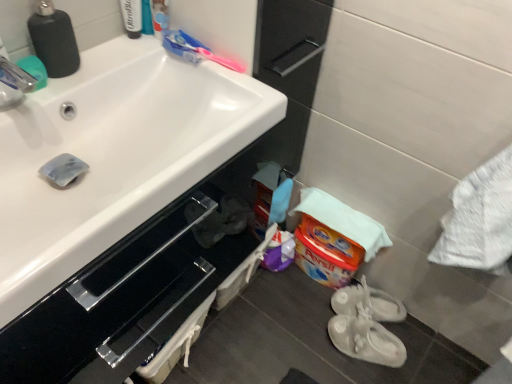
Where is `black glossy drawer at lower center`? This screenshot has width=512, height=384. black glossy drawer at lower center is located at coordinates (155, 317).

Locate an element on the screen. black matte soap dispenser at upper left is located at coordinates coord(54,39).

Where is `white glossy tube at upper left, the first toiletry positioned from the left`? white glossy tube at upper left, the first toiletry positioned from the left is located at coordinates click(132, 17).

Is white rubber shoes at lower right, positioned as the 1th footwear in back-to-front order, not within translucent plastic toothbrush at upper center, positioned as the second toiletry in left-to-right order?

Yes, white rubber shoes at lower right, positioned as the 1th footwear in back-to-front order, is located beyond the bounds of translucent plastic toothbrush at upper center, positioned as the second toiletry in left-to-right order.

How many degrees apart are the facing directions of white rubber shoes at lower right, positioned as the 1th footwear in back-to-front order, and translucent plastic toothbrush at upper center, arranged as the first toiletry when viewed from the right?

The angular difference between white rubber shoes at lower right, positioned as the 1th footwear in back-to-front order, and translucent plastic toothbrush at upper center, arranged as the first toiletry when viewed from the right, is 127 degrees.

Relative to translucent plastic toothbrush at upper center, positioned as the second toiletry in left-to-right order, is white rubber shoes at lower right, positioned as the 1th footwear in back-to-front order, in front or behind?

white rubber shoes at lower right, positioned as the 1th footwear in back-to-front order, is positioned farther from the viewer than translucent plastic toothbrush at upper center, positioned as the second toiletry in left-to-right order.

Does point (98, 292) appear closer or farther from the camera than point (136, 1)?

Point (98, 292) is closer to the camera than point (136, 1).

From the image's perspective, starting from the black glossy cabinet at lower left, which toiletry is the 1st one above? Please provide its 2D coordinates.

[(132, 17)]

Is white glossy tube at upper left, which ranks as the 2th toiletry in right-to-left order, surrounded by black glossy cabinet at lower left?

No, white glossy tube at upper left, which ranks as the 2th toiletry in right-to-left order, is not inside black glossy cabinet at lower left.

Which object is closer to the camera, black glossy cabinet at lower left or white glossy tube at upper left, which ranks as the 2th toiletry in right-to-left order?

Positioned in front is black glossy cabinet at lower left.

Is there a large distance between black matte soap dispenser at upper left and white rubber shoes at lower right, the 2th footwear positioned from the front?

Indeed, black matte soap dispenser at upper left is not near white rubber shoes at lower right, the 2th footwear positioned from the front.

From the picture: Is black matte soap dispenser at upper left turned away from white rubber shoes at lower right, positioned as the 1th footwear in back-to-front order?

No, black matte soap dispenser at upper left is not facing the opposite direction of white rubber shoes at lower right, positioned as the 1th footwear in back-to-front order.

How far apart are black matte soap dispenser at upper left and white rubber shoes at lower right, positioned as the 1th footwear in back-to-front order?

1.14 meters.

From a real-world perspective, who is located higher, black matte soap dispenser at upper left or white rubber shoes at lower right, the 2th footwear positioned from the front?

black matte soap dispenser at upper left.

Is there a large distance between black glossy cabinet at lower left and white rubber shoes at lower right, the 2th footwear positioned from the front?

No, black glossy cabinet at lower left is not far away from white rubber shoes at lower right, the 2th footwear positioned from the front.

Is black glossy cabinet at lower left completely or partially outside of white rubber shoes at lower right, positioned as the 1th footwear in back-to-front order?

Absolutely, black glossy cabinet at lower left is external to white rubber shoes at lower right, positioned as the 1th footwear in back-to-front order.

Is point (70, 354) in front of point (370, 296)?

Yes, it is in front of point (370, 296).

The height and width of the screenshot is (384, 512). I want to click on toothbrush on the right of white glossy sink at upper left, so click(194, 50).

Does point (185, 71) come behind point (196, 57)?

Yes, point (185, 71) is farther from viewer.

How different are the orientations of white glossy sink at upper left and pink plastic toothbrush at upper center in degrees?

white glossy sink at upper left and pink plastic toothbrush at upper center are facing 88 degrees away from each other.

Is white glossy sink at upper left taller than pink plastic toothbrush at upper center?

Result: Yes, white glossy sink at upper left is taller than pink plastic toothbrush at upper center.

Considering the positions of objects black matte soap dispenser at upper left and white rubber shoes at lower right, which is the 2th footwear from back to front, in the image provided, who is more to the left, black matte soap dispenser at upper left or white rubber shoes at lower right, which is the 2th footwear from back to front,?

black matte soap dispenser at upper left.

Between black matte soap dispenser at upper left and white rubber shoes at lower right, which is the 2th footwear from back to front, which one has smaller width?

black matte soap dispenser at upper left.

From the picture: Is black matte soap dispenser at upper left facing away from white rubber shoes at lower right, which is the 2th footwear from back to front?

No, black matte soap dispenser at upper left is not facing away from white rubber shoes at lower right, which is the 2th footwear from back to front.

Can you see black matte soap dispenser at upper left touching white rubber shoes at lower right, which is the 2th footwear from back to front?

No, black matte soap dispenser at upper left is not with white rubber shoes at lower right, which is the 2th footwear from back to front.

The height and width of the screenshot is (384, 512). What are the coordinates of `bathroom cabinet that is in front of the translucent plastic toothbrush at upper center, positioned as the second toiletry in left-to-right order` in the screenshot? It's located at (130, 292).

Are translucent plastic toothbrush at upper center, positioned as the second toiletry in left-to-right order, and black glossy cabinet at lower left located far from each other?

No, there isn't a large distance between translucent plastic toothbrush at upper center, positioned as the second toiletry in left-to-right order, and black glossy cabinet at lower left.

Does point (152, 1) come closer to viewer compared to point (191, 203)?

No.

From the image's perspective, between translucent plastic toothbrush at upper center, positioned as the second toiletry in left-to-right order, and black glossy cabinet at lower left, which one is located above?

From the image's view, translucent plastic toothbrush at upper center, positioned as the second toiletry in left-to-right order, is above.

From the translucent plastic toothbrush at upper center, arranged as the first toiletry when viewed from the right, count 2nd footwears backward and point to it. Please provide its 2D coordinates.

[(368, 303)]

I want to click on the 1st toiletry above the black glossy cabinet at lower left (from a real-world perspective), so click(132, 17).

Looking at the image, which one is located closer to white rubber shoes at lower right, positioned as the 1th footwear in back-to-front order, white glossy tube at upper left, which ranks as the 2th toiletry in right-to-left order, or black glossy drawer at lower center?

black glossy drawer at lower center is positioned closer to the anchor white rubber shoes at lower right, positioned as the 1th footwear in back-to-front order.

Looking at the image, which one is located further to white rubber shoes at lower right, the 2th footwear positioned from the front, white glossy sink at upper left or pink plastic toothbrush at upper center?

white glossy sink at upper left lies further to white rubber shoes at lower right, the 2th footwear positioned from the front, than the other object.

Based on their spatial positions, is black glossy cabinet at lower left or black glossy drawer at lower center closer to black matte soap dispenser at upper left?

Based on the image, black glossy cabinet at lower left appears to be nearer to black matte soap dispenser at upper left.

Based on their spatial positions, is black glossy cabinet at lower left or translucent plastic toothbrush at upper center, arranged as the first toiletry when viewed from the right, further from pink plastic toothbrush at upper center?

black glossy cabinet at lower left.

Based on their spatial positions, is black glossy drawer at lower center or white rubber shoes at lower right, which is the 2th footwear from back to front, further from white rubber shoes at lower right, the 2th footwear positioned from the front?

The object further to white rubber shoes at lower right, the 2th footwear positioned from the front, is black glossy drawer at lower center.

Looking at this image, estimate the real-world distances between objects in this image. Which object is closer to white rubber shoes at lower right, positioned as the 1th footwear in back-to-front order, pink plastic toothbrush at upper center or white glossy tube at upper left, the first toiletry positioned from the left?

Among the two, pink plastic toothbrush at upper center is located nearer to white rubber shoes at lower right, positioned as the 1th footwear in back-to-front order.

Which object lies further to the anchor point black glossy drawer at lower center, translucent plastic toothbrush at upper center, positioned as the second toiletry in left-to-right order, or white glossy sink at upper left?

Among the two, translucent plastic toothbrush at upper center, positioned as the second toiletry in left-to-right order, is located further to black glossy drawer at lower center.

Looking at the image, which one is located closer to white rubber shoes at lower right, the 2th footwear positioned from the front, white rubber shoes at lower right, which is the 2th footwear from back to front, or black glossy drawer at lower center?

white rubber shoes at lower right, which is the 2th footwear from back to front, is closer to white rubber shoes at lower right, the 2th footwear positioned from the front.

Where is `soap dispenser between translucent plastic toothbrush at upper center, arranged as the first toiletry when viewed from the right, and black glossy drawer at lower center in the up-down direction`? The width and height of the screenshot is (512, 384). soap dispenser between translucent plastic toothbrush at upper center, arranged as the first toiletry when viewed from the right, and black glossy drawer at lower center in the up-down direction is located at coordinates (54, 39).

Find the location of `bathroom cabinet between translucent plastic toothbrush at upper center, positioned as the second toiletry in left-to-right order, and black glossy drawer at lower center from top to bottom`. bathroom cabinet between translucent plastic toothbrush at upper center, positioned as the second toiletry in left-to-right order, and black glossy drawer at lower center from top to bottom is located at coordinates (130, 292).

What are the coordinates of `toiletry located between white glossy tube at upper left, which ranks as the 2th toiletry in right-to-left order, and pink plastic toothbrush at upper center in the left-right direction` in the screenshot? It's located at (159, 17).

Locate an element on the screen. The image size is (512, 384). toiletry between translucent plastic toothbrush at upper center, positioned as the second toiletry in left-to-right order, and black glossy cabinet at lower left, in the vertical direction is located at coordinates (132, 17).